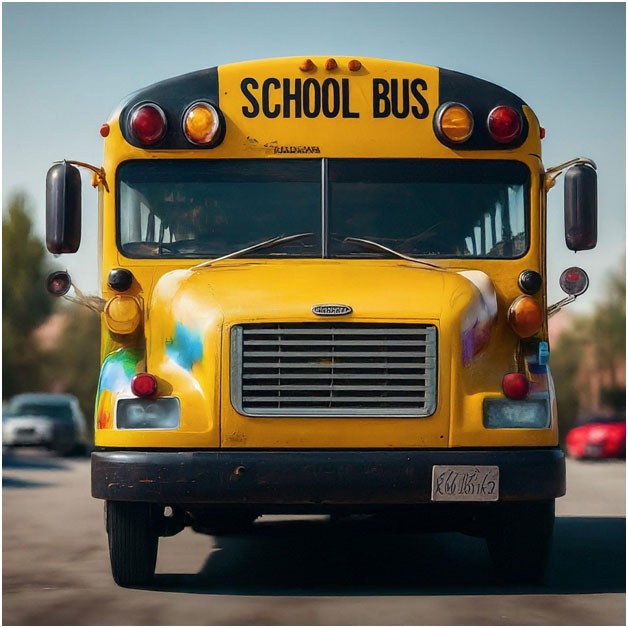
At what (x,y) coordinates should I click in order to perform the action: click on clearance lamps. Please return your answer as a coordinate pair (x, y). This screenshot has height=628, width=628. Looking at the image, I should click on (56, 208), (588, 202).